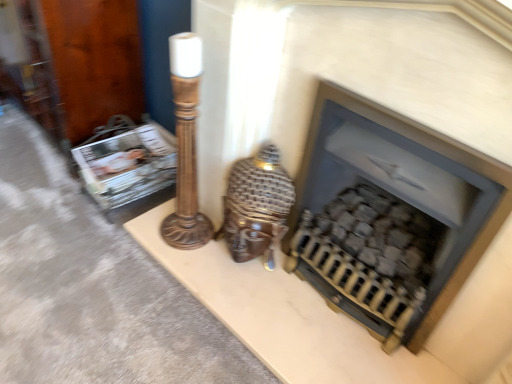
The height and width of the screenshot is (384, 512). What do you see at coordinates (390, 215) in the screenshot? I see `matte black fireplace at center` at bounding box center [390, 215].

This screenshot has height=384, width=512. I want to click on matte plastic magazine at left, so tap(128, 165).

Which is in front, point (233, 245) or point (146, 183)?

The point (233, 245) is in front.

Can you confirm if brown wooden table lamp at center is thinner than matte plastic magazine at left?

Yes.

Would you consider brown wooden table lamp at center to be distant from matte plastic magazine at left?

They are positioned close to each other.

Would you say brown wooden table lamp at center is inside or outside matte plastic magazine at left?

brown wooden table lamp at center is outside matte plastic magazine at left.

Is matte plastic magazine at left at the right side of brown wooden table lamp at center?

No.

Image resolution: width=512 pixels, height=384 pixels. Find the location of `magazine that is behind the brown wooden table lamp at center`. magazine that is behind the brown wooden table lamp at center is located at coordinates (128, 165).

Is brown wooden table lamp at center at the back of matte plastic magazine at left?

No.

Does matte black fireplace at center have a lesser height compared to brown wooden table lamp at center?

Incorrect, the height of matte black fireplace at center does not fall short of that of brown wooden table lamp at center.

This screenshot has width=512, height=384. I want to click on fireplace that appears above the brown wooden table lamp at center (from a real-world perspective), so click(390, 215).

Which is closer, [388,237] or [272,206]?

Point [388,237] appears to be closer to the viewer than point [272,206].

From a real-world perspective, which is physically below, brown wooden table lamp at center or matte black fireplace at center?

From a 3D spatial view, brown wooden table lamp at center is below.

Choose the correct answer: Is brown wooden table lamp at center inside matte black fireplace at center or outside it?

brown wooden table lamp at center lies outside matte black fireplace at center.

Where is `table lamp behind the matte black fireplace at center`? Image resolution: width=512 pixels, height=384 pixels. table lamp behind the matte black fireplace at center is located at coordinates (256, 206).

Considering the positions of objects brown wooden table lamp at center and matte black fireplace at center in the image provided, who is in front, brown wooden table lamp at center or matte black fireplace at center?

Result: matte black fireplace at center is in front.

From a real-world perspective, relative to matte black fireplace at center, is matte plastic magazine at left vertically above or below?

In terms of real-world spatial position, matte plastic magazine at left is below matte black fireplace at center.

Can you confirm if matte plastic magazine at left is wider than matte black fireplace at center?

Indeed, matte plastic magazine at left has a greater width compared to matte black fireplace at center.

From the image's perspective, is matte plastic magazine at left located beneath matte black fireplace at center?

No, from the image's perspective, matte plastic magazine at left is not beneath matte black fireplace at center.

Which object is further away from the camera taking this photo, matte plastic magazine at left or matte black fireplace at center?

matte plastic magazine at left is more distant.

Is matte black fireplace at center positioned far away from matte plastic magazine at left?

matte black fireplace at center is actually quite close to matte plastic magazine at left.

Considering the positions of objects matte black fireplace at center and matte plastic magazine at left in the image provided, who is more to the right, matte black fireplace at center or matte plastic magazine at left?

From the viewer's perspective, matte black fireplace at center appears more on the right side.

Does matte black fireplace at center come behind matte plastic magazine at left?

No, it is in front of matte plastic magazine at left.

Between point (438, 150) and point (89, 155), which one is positioned behind?

The point (89, 155) is more distant.

Where is `magazine on the left of brown wooden table lamp at center`? magazine on the left of brown wooden table lamp at center is located at coordinates (128, 165).

Find the location of `magazine above the brown wooden table lamp at center (from the image's perspective)`. magazine above the brown wooden table lamp at center (from the image's perspective) is located at coordinates (128, 165).

Which object lies further to the anchor point matte black fireplace at center, brown wooden table lamp at center or matte plastic magazine at left?

The object further to matte black fireplace at center is matte plastic magazine at left.

From the picture: Based on their spatial positions, is matte black fireplace at center or brown wooden table lamp at center closer to matte plastic magazine at left?

The object closer to matte plastic magazine at left is brown wooden table lamp at center.

From the image, which object appears to be farther from matte black fireplace at center, matte plastic magazine at left or brown wooden table lamp at center?

Based on the image, matte plastic magazine at left appears to be further to matte black fireplace at center.

From the image, which object appears to be nearer to brown wooden table lamp at center, matte black fireplace at center or matte plastic magazine at left?

Among the two, matte black fireplace at center is located nearer to brown wooden table lamp at center.

From the picture: Which object lies nearer to the anchor point matte plastic magazine at left, brown wooden table lamp at center or matte black fireplace at center?

brown wooden table lamp at center is positioned closer to the anchor matte plastic magazine at left.

From the image, which object appears to be farther from brown wooden table lamp at center, matte plastic magazine at left or matte black fireplace at center?

matte plastic magazine at left lies further to brown wooden table lamp at center than the other object.

Where is `table lamp between matte plastic magazine at left and matte black fireplace at center from left to right`? table lamp between matte plastic magazine at left and matte black fireplace at center from left to right is located at coordinates (256, 206).